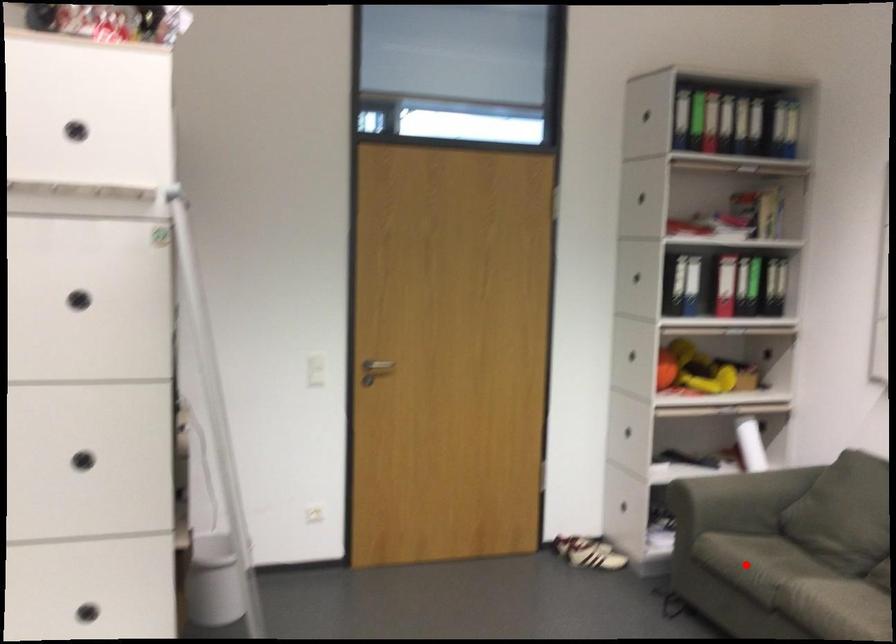
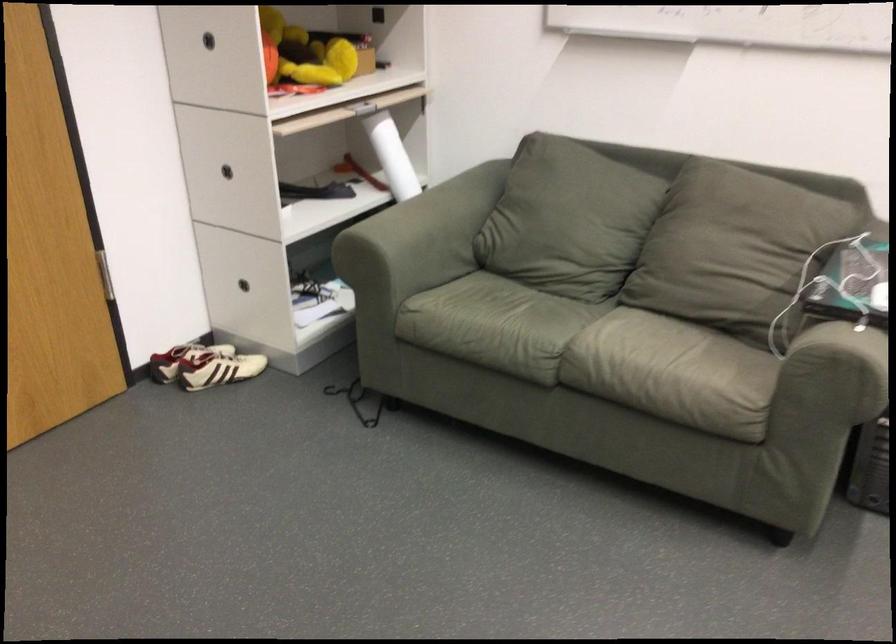
The point at the highlighted location is marked in the first image. Where is the corresponding point in the second image?

(495, 325)